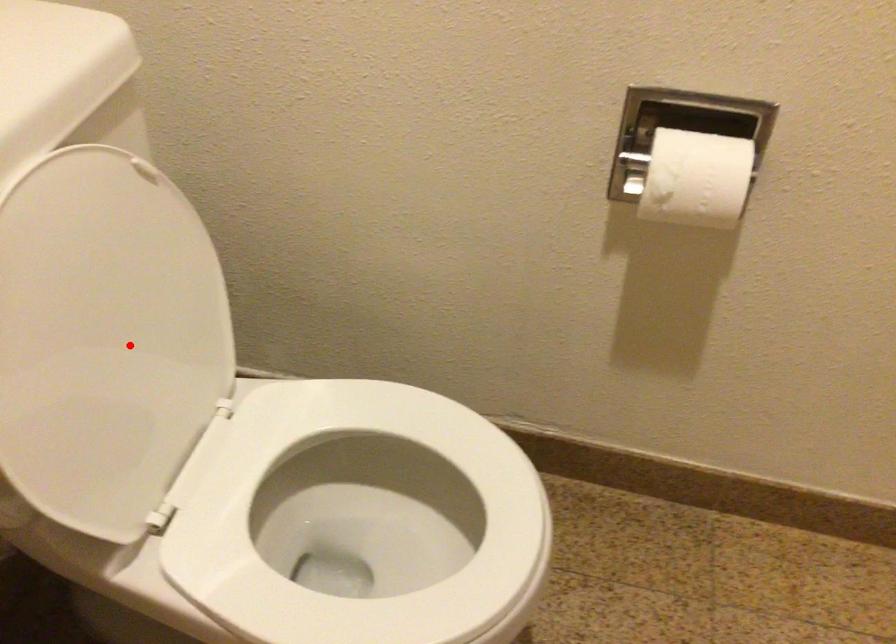
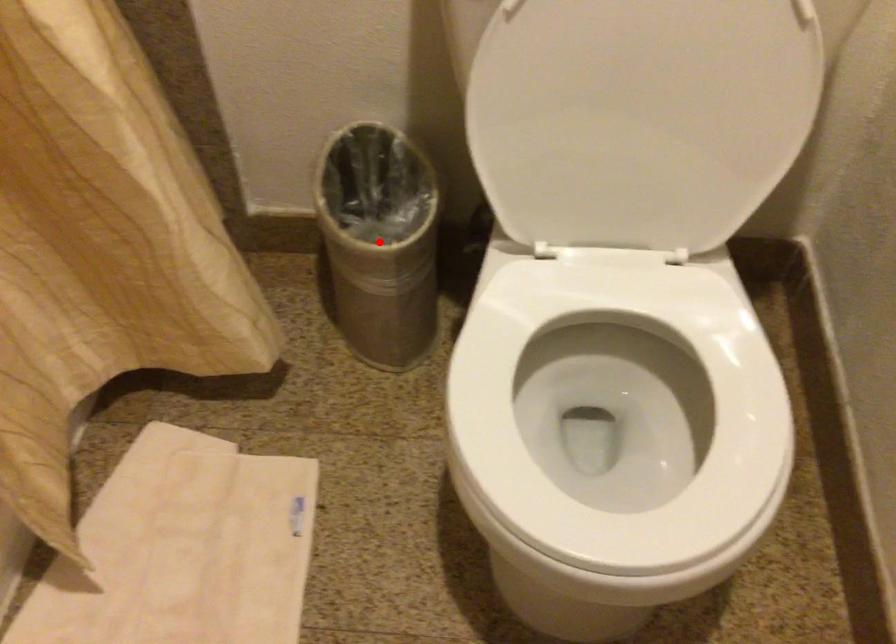
I am providing you with two images of the same scene from different viewpoints. A red point is marked on the first image and another point is marked on the second image. Is the red point in image1 aligned with the point shown in image2?

No